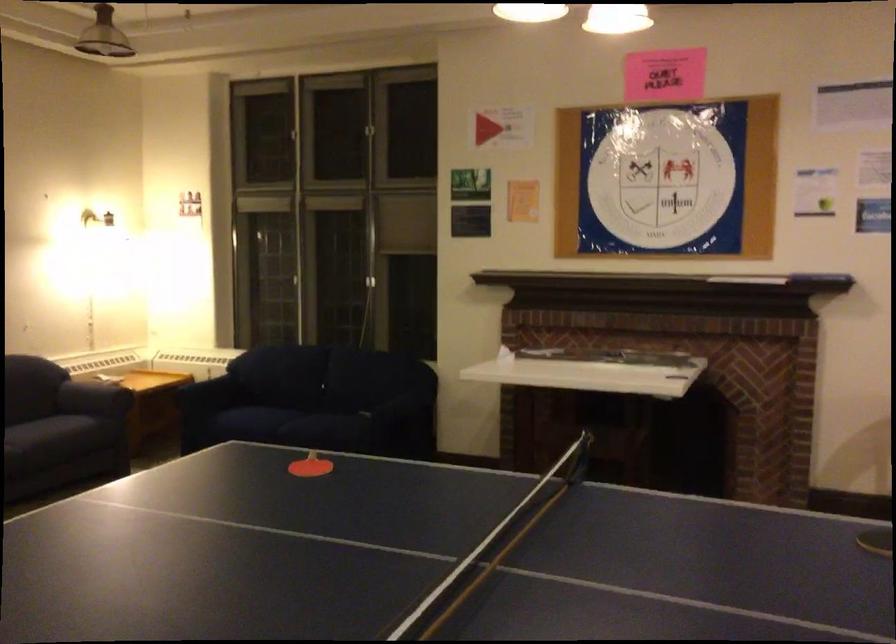
Where would you sit the dark sofa sitting surface? Please return your answer as a coordinate pair (x, y).

(49, 442)